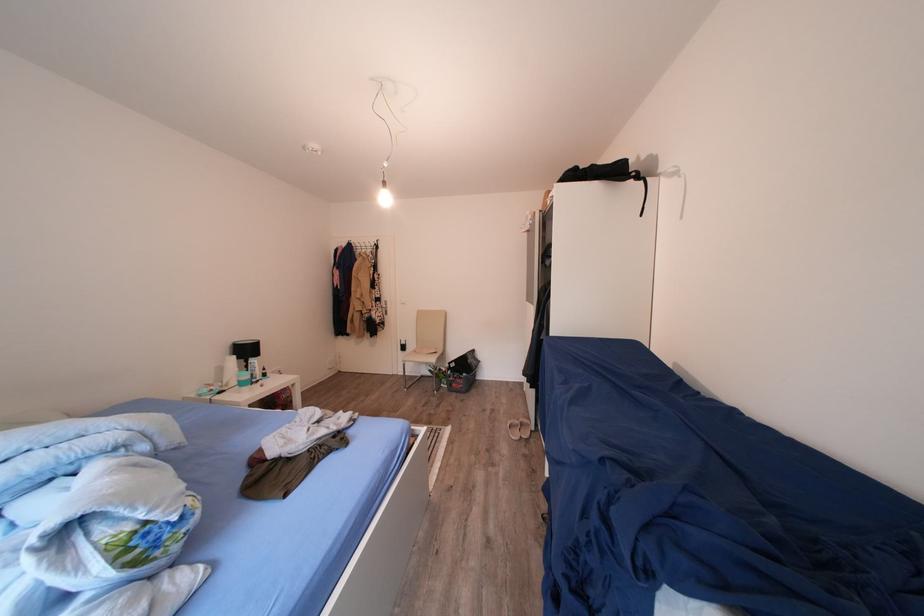
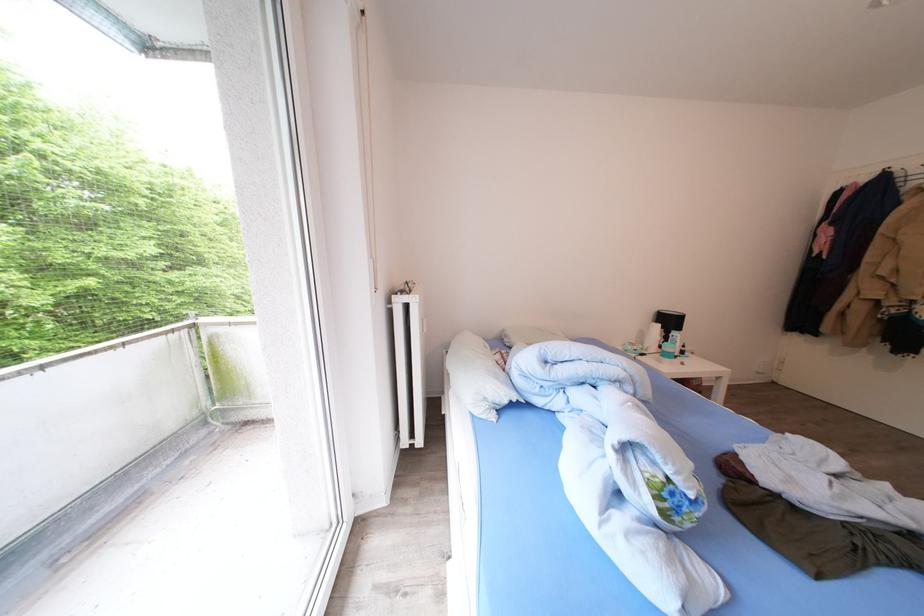
Where in the second image is the point corresponding to point 256,355 from the first image?

(677, 326)